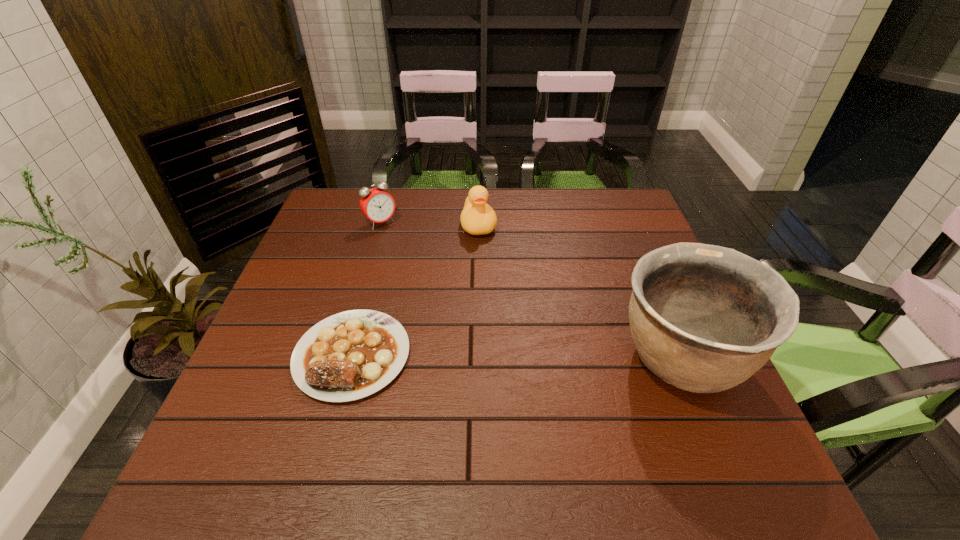
The height and width of the screenshot is (540, 960). I want to click on object present at the far left corner, so click(x=376, y=204).

Locate an element on the screen. object located at the near left corner is located at coordinates (350, 355).

Identify the location of object located at the near right corner. pos(704,318).

Image resolution: width=960 pixels, height=540 pixels. What are the coordinates of `free spot at the far edge of the desktop` in the screenshot? It's located at (538, 208).

Image resolution: width=960 pixels, height=540 pixels. What are the coordinates of `free space at the near edge of the desktop` in the screenshot? It's located at (376, 398).

Identify the location of free space at the left edge of the desktop. (334, 315).

I want to click on free space at the far left corner, so click(341, 210).

In order to click on vacant space at the near left corner of the desktop in this screenshot , I will do `click(236, 407)`.

Locate an element on the screen. This screenshot has height=540, width=960. free spot at the far right corner of the desktop is located at coordinates (610, 193).

The width and height of the screenshot is (960, 540). What are the coordinates of `free space at the near right corner of the desktop` in the screenshot? It's located at (660, 402).